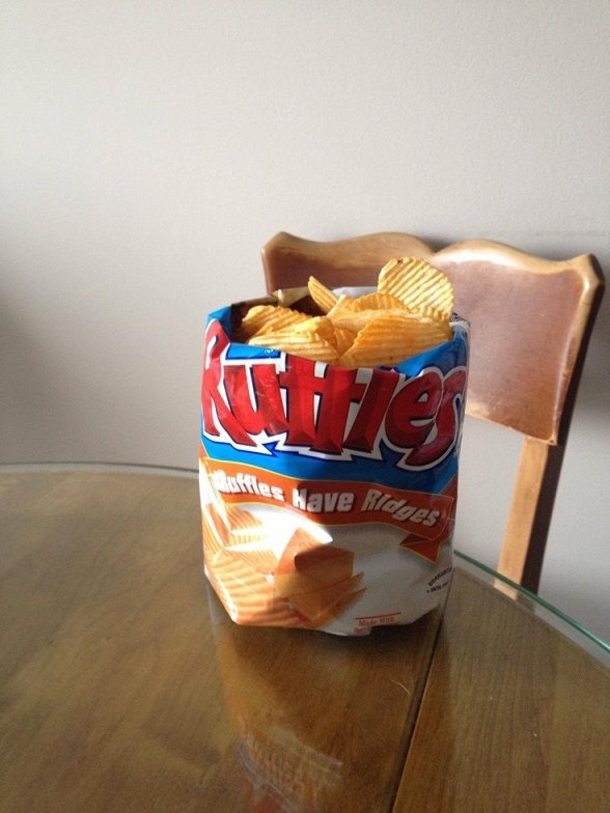
Find the location of a particular element. The height and width of the screenshot is (813, 610). wear and tear on chair is located at coordinates (475, 249).